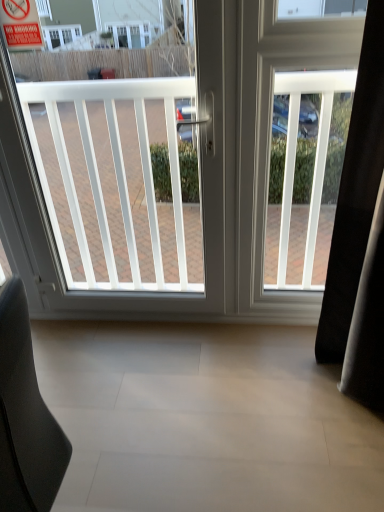
Where is `vacant area situated below white plastic window at center (from a real-world perspective)`? The height and width of the screenshot is (512, 384). vacant area situated below white plastic window at center (from a real-world perspective) is located at coordinates (137, 324).